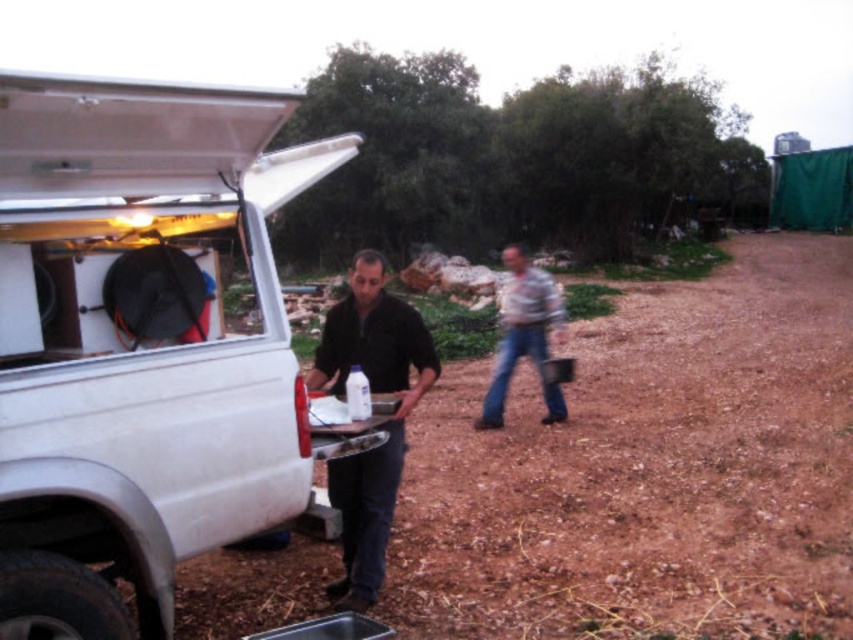
Question: Which point is farther to the camera?

Choices:
 (A) brown dirt field at center
 (B) black matte shirt at center
 (C) light gray textured shirt at center

Answer: (C)

Question: Which object appears closest to the camera in this image?

Choices:
 (A) light gray textured shirt at center
 (B) brown dirt field at center
 (C) white matte van at center
 (D) black matte shirt at center

Answer: (C)

Question: Is brown dirt field at center above light gray textured shirt at center?

Choices:
 (A) no
 (B) yes

Answer: (A)

Question: Among these points, which one is farthest from the camera?

Choices:
 (A) (793, 252)
 (B) (556, 390)
 (C) (86, 602)

Answer: (A)

Question: Is brown dirt field at center bigger than black matte shirt at center?

Choices:
 (A) no
 (B) yes

Answer: (B)

Question: Does brown dirt field at center lie behind light gray textured shirt at center?

Choices:
 (A) yes
 (B) no

Answer: (B)